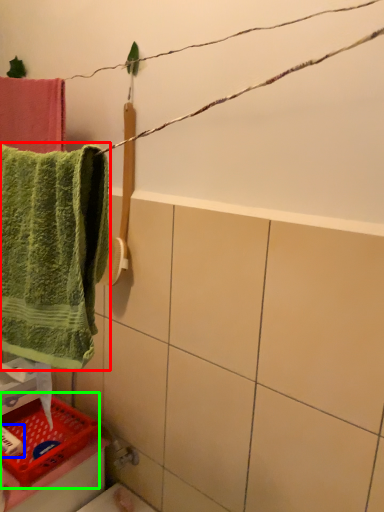
Question: Based on their relative distances, which object is nearer to towel (highlighted by a red box)? Choose from toiletry (highlighted by a blue box) and basket (highlighted by a green box).

Choices:
 (A) toiletry
 (B) basket

Answer: (B)